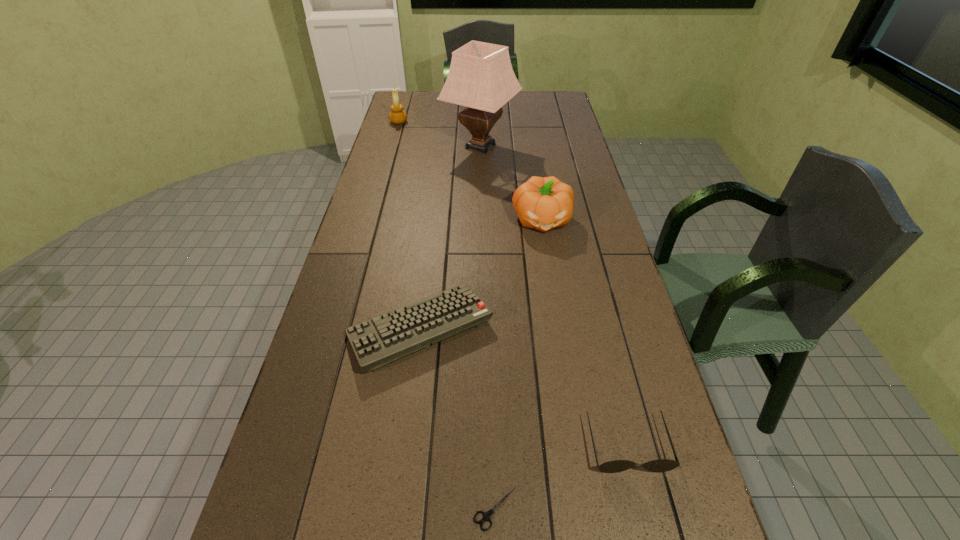
This screenshot has width=960, height=540. What are the coordinates of `free space at the left edge` in the screenshot? It's located at (413, 139).

In the image, there is a desktop. At what (x,y) coordinates should I click in order to perform the action: click on vacant space at the right edge. Please return your answer as a coordinate pair (x, y). Looking at the image, I should click on (635, 380).

Image resolution: width=960 pixels, height=540 pixels. I want to click on vacant space at the far left corner, so point(427,93).

In the image, there is a desktop. Where is `blank space at the far right corner`? This screenshot has height=540, width=960. blank space at the far right corner is located at coordinates (536, 104).

Locate an element on the screen. free space between the farthest object and the second farthest object is located at coordinates (440, 134).

The width and height of the screenshot is (960, 540). Identify the location of vacant point located between the farthest object and the tallest object. (440, 134).

I want to click on free space between the third nearest object and the third farthest object, so click(x=481, y=274).

Locate an element on the screen. Image resolution: width=960 pixels, height=540 pixels. vacant area that lies between the farthest object and the fourth tallest object is located at coordinates (514, 283).

Identify the location of unoccupied position between the lampshade and the pumpkin. (512, 183).

Identify the location of free space between the pumpkin and the second shortest object. The height and width of the screenshot is (540, 960). (481, 274).